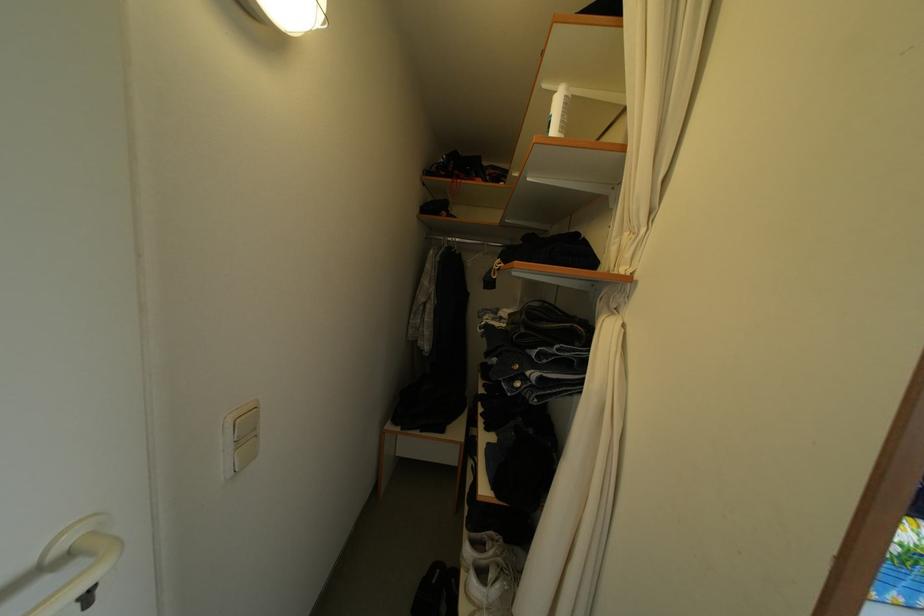
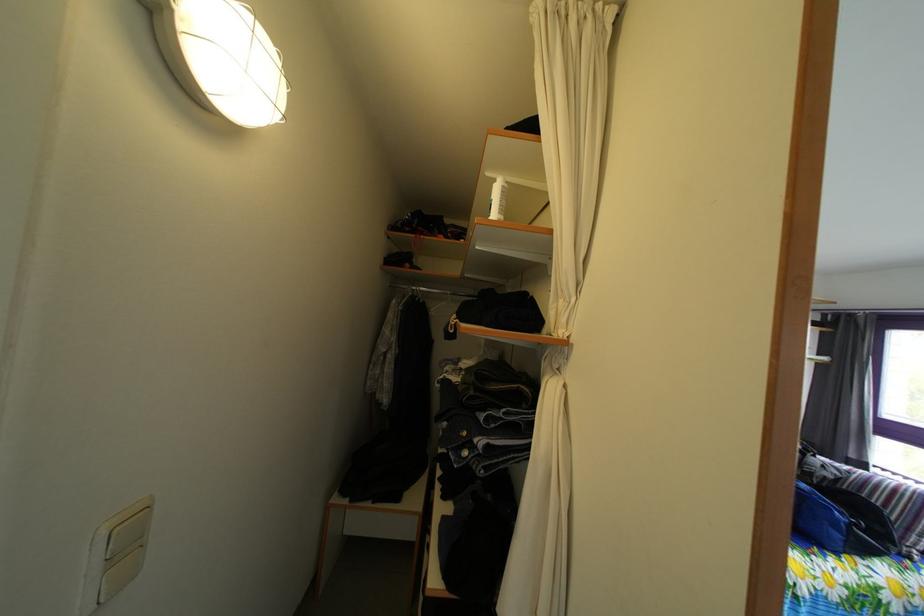
Locate, in the second image, the point that corresponds to [239,430] in the first image.

(116, 541)